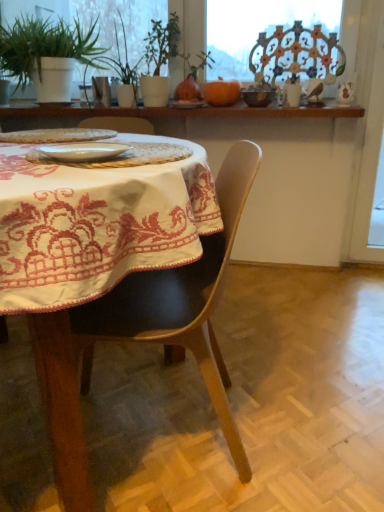
Question: Is green leafy plant at upper center taller than white glossy plate at center, arranged as the second tableware when viewed from the back?

Choices:
 (A) yes
 (B) no

Answer: (A)

Question: Is green leafy plant at upper center outside of white glossy plate at center, arranged as the second tableware when viewed from the back?

Choices:
 (A) no
 (B) yes

Answer: (B)

Question: Does green leafy plant at upper center have a smaller size compared to white glossy plate at center, which ranks as the second tableware in top-to-bottom order?

Choices:
 (A) no
 (B) yes

Answer: (A)

Question: Does green leafy plant at upper center have a larger size compared to white glossy plate at center, arranged as the second tableware when viewed from the back?

Choices:
 (A) yes
 (B) no

Answer: (A)

Question: Does green leafy plant at upper center have a greater width compared to white glossy plate at center, which is the 1th tableware from left to right?

Choices:
 (A) no
 (B) yes

Answer: (B)

Question: Do you think white embroidered tablecloth at center is within green leafy plant at upper center, or outside of it?

Choices:
 (A) inside
 (B) outside

Answer: (B)

Question: Considering the positions of white embroidered tablecloth at center and green leafy plant at upper center in the image, is white embroidered tablecloth at center bigger or smaller than green leafy plant at upper center?

Choices:
 (A) small
 (B) big

Answer: (B)

Question: Considering the positions of white embroidered tablecloth at center and green leafy plant at upper center in the image, is white embroidered tablecloth at center wider or thinner than green leafy plant at upper center?

Choices:
 (A) thin
 (B) wide

Answer: (B)

Question: In terms of height, does white embroidered tablecloth at center look taller or shorter compared to green leafy plant at upper center?

Choices:
 (A) tall
 (B) short

Answer: (B)

Question: From the image's perspective, is green matte plant at upper left located above or below black leather chair at center?

Choices:
 (A) above
 (B) below

Answer: (A)

Question: Is green matte plant at upper left bigger or smaller than black leather chair at center?

Choices:
 (A) big
 (B) small

Answer: (B)

Question: In the image, is green matte plant at upper left positioned in front of or behind black leather chair at center?

Choices:
 (A) behind
 (B) front

Answer: (A)

Question: From a real-world perspective, is green matte plant at upper left above or below black leather chair at center?

Choices:
 (A) above
 (B) below

Answer: (A)

Question: Is point pos(119,66) closer or farther from the camera than point pos(74,145)?

Choices:
 (A) closer
 (B) farther

Answer: (B)

Question: Considering the positions of green leafy plant at upper center and white glossy plate at center, which is counted as the second tableware, starting from the right, in the image, is green leafy plant at upper center bigger or smaller than white glossy plate at center, which is counted as the second tableware, starting from the right,?

Choices:
 (A) small
 (B) big

Answer: (B)